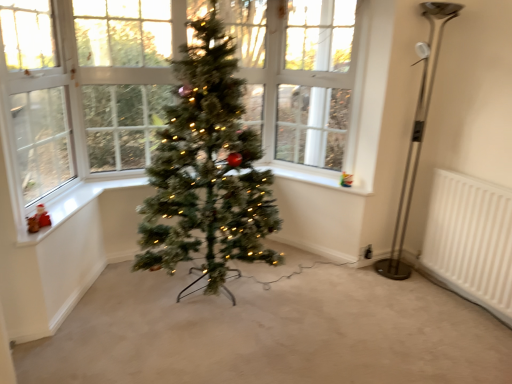
What do you see at coordinates (207, 169) in the screenshot? I see `green artificial christmas tree at center` at bounding box center [207, 169].

Describe the element at coordinates (417, 133) in the screenshot. I see `polished metal floor lamp at right` at that location.

Locate an element on the screen. This screenshot has height=384, width=512. clear glass window at left, which is the second window screen from right to left is located at coordinates [36, 98].

Where is `green artificial christmas tree at center`? The height and width of the screenshot is (384, 512). green artificial christmas tree at center is located at coordinates [x=207, y=169].

Consider the image. Which is more to the left, clear glass window at upper center, which appears as the first window screen when viewed from the back, or white painted wood at lower left, which appears as the first window sill when viewed from the front?

white painted wood at lower left, which appears as the first window sill when viewed from the front.

Looking at this image, who is taller, clear glass window at upper center, which appears as the first window screen when viewed from the back, or white painted wood at lower left, which is the 1th window sill from left to right?

Standing taller between the two is clear glass window at upper center, which appears as the first window screen when viewed from the back.

Between clear glass window at upper center, which appears as the first window screen when viewed from the back, and white painted wood at lower left, which ranks as the 2th window sill in right-to-left order, which one has larger width?

white painted wood at lower left, which ranks as the 2th window sill in right-to-left order.

In the scene shown: Can we say green artificial christmas tree at center lies outside clear glass window at left, the 1th window screen positioned from the front?

green artificial christmas tree at center is positioned outside clear glass window at left, the 1th window screen positioned from the front.

The width and height of the screenshot is (512, 384). I want to click on window screen that appears on the left of green artificial christmas tree at center, so click(36, 98).

Which of these two, green artificial christmas tree at center or clear glass window at left, which ranks as the first window screen in left-to-right order, is smaller?

Smaller between the two is clear glass window at left, which ranks as the first window screen in left-to-right order.

Is point (257, 249) closer or farther from the camera than point (29, 22)?

Point (257, 249) is farther from the camera than point (29, 22).

Does green artificial christmas tree at center have a greater height compared to white plastic at upper center, which is counted as the first window sill, starting from the right?

Yes, green artificial christmas tree at center is taller than white plastic at upper center, which is counted as the first window sill, starting from the right.

Between green artificial christmas tree at center and white plastic at upper center, which is counted as the first window sill, starting from the right, which one appears on the right side from the viewer's perspective?

Positioned to the right is white plastic at upper center, which is counted as the first window sill, starting from the right.

Is point (208, 135) less distant than point (331, 175)?

Yes, point (208, 135) is in front of point (331, 175).

How different are the orientations of green artificial christmas tree at center and white plastic at upper center, which is counted as the first window sill, starting from the right, in degrees?

The facing directions of green artificial christmas tree at center and white plastic at upper center, which is counted as the first window sill, starting from the right, are 59.7 degrees apart.

Which object is positioned more to the left, clear glass window at left, which ranks as the first window screen in left-to-right order, or polished metal floor lamp at right?

From the viewer's perspective, clear glass window at left, which ranks as the first window screen in left-to-right order, appears more on the left side.

From a real-world perspective, which is physically below, clear glass window at left, which is the second window screen from right to left, or polished metal floor lamp at right?

polished metal floor lamp at right, from a real-world perspective.

Can you confirm if clear glass window at left, which ranks as the first window screen in left-to-right order, is thinner than polished metal floor lamp at right?

Yes, clear glass window at left, which ranks as the first window screen in left-to-right order, is thinner than polished metal floor lamp at right.

Considering the sizes of clear glass window at left, which ranks as the first window screen in left-to-right order, and polished metal floor lamp at right in the image, is clear glass window at left, which ranks as the first window screen in left-to-right order, taller or shorter than polished metal floor lamp at right?

Considering their sizes, clear glass window at left, which ranks as the first window screen in left-to-right order, has less height than polished metal floor lamp at right.

From a real-world perspective, is clear glass window at left, the 1th window screen positioned from the front, positioned over green artificial christmas tree at center based on gravity?

Indeed, from a real-world perspective, clear glass window at left, the 1th window screen positioned from the front, stands above green artificial christmas tree at center.

Considering the sizes of objects clear glass window at left, which is the second window screen in back-to-front order, and green artificial christmas tree at center in the image provided, who is smaller, clear glass window at left, which is the second window screen in back-to-front order, or green artificial christmas tree at center?

With smaller size is clear glass window at left, which is the second window screen in back-to-front order.

Which of these two, clear glass window at left, which ranks as the first window screen in left-to-right order, or green artificial christmas tree at center, stands shorter?

Standing shorter between the two is clear glass window at left, which ranks as the first window screen in left-to-right order.

Can you see white plastic at upper center, the second window sill when ordered from front to back, touching white painted wood at lower left, the second window sill from the back?

No.

From the image's perspective, which one is positioned lower, white plastic at upper center, acting as the second window sill starting from the left, or white painted wood at lower left, which ranks as the 2th window sill in right-to-left order?

white painted wood at lower left, which ranks as the 2th window sill in right-to-left order, from the image's perspective.

Is white plastic at upper center, the second window sill when ordered from front to back, looking in the opposite direction of white painted wood at lower left, the second window sill from the back?

white plastic at upper center, the second window sill when ordered from front to back, is not turned away from white painted wood at lower left, the second window sill from the back.

Is white plastic at upper center, the second window sill when ordered from front to back, completely or partially outside of white painted wood at lower left, the second window sill from the back?

Absolutely, white plastic at upper center, the second window sill when ordered from front to back, is external to white painted wood at lower left, the second window sill from the back.

Is white painted wood at lower left, which ranks as the 2th window sill in right-to-left order, inside or outside of white plastic at upper center, acting as the second window sill starting from the left?

white painted wood at lower left, which ranks as the 2th window sill in right-to-left order, lies outside white plastic at upper center, acting as the second window sill starting from the left.

Looking at the image, does white painted wood at lower left, the second window sill from the back, seem bigger or smaller compared to white plastic at upper center, the second window sill when ordered from front to back?

Considering their sizes, white painted wood at lower left, the second window sill from the back, takes up less space than white plastic at upper center, the second window sill when ordered from front to back.

Looking at this image, is white painted wood at lower left, which is the 1th window sill from left to right, turned away from white plastic at upper center, the second window sill when ordered from front to back?

No.

This screenshot has height=384, width=512. Identify the location of window sill in front of the white plastic at upper center, which is counted as the 1th window sill, starting from the back. (65, 209).

Find the location of a particular element. window screen behind the white painted wood at lower left, which appears as the first window sill when viewed from the front is located at coordinates (315, 83).

At what (x,y) coordinates should I click in order to perform the action: click on christmas tree beneath the clear glass window at left, the 1th window screen positioned from the front (from a real-world perspective). Please return your answer as a coordinate pair (x, y). The width and height of the screenshot is (512, 384). Looking at the image, I should click on (207, 169).

From the image, which object appears to be farther from white plastic at upper center, the second window sill when ordered from front to back, white painted wood at lower left, which ranks as the 2th window sill in right-to-left order, or polished metal floor lamp at right?

white painted wood at lower left, which ranks as the 2th window sill in right-to-left order, is further to white plastic at upper center, the second window sill when ordered from front to back.

Consider the image. Estimate the real-world distances between objects in this image. Which object is further from polished metal floor lamp at right, clear glass window at left, the 1th window screen positioned from the front, or clear glass window at upper center, which appears as the first window screen when viewed from the back?

Based on the image, clear glass window at left, the 1th window screen positioned from the front, appears to be further to polished metal floor lamp at right.

Which object lies further to the anchor point clear glass window at upper center, the second window screen positioned from the left, white painted wood at lower left, the second window sill from the back, or green artificial christmas tree at center?

white painted wood at lower left, the second window sill from the back.

From the image, which object appears to be nearer to white plastic at upper center, which is counted as the 1th window sill, starting from the back, green artificial christmas tree at center or clear glass window at left, which is the second window screen from right to left?

green artificial christmas tree at center is closer to white plastic at upper center, which is counted as the 1th window sill, starting from the back.

Based on their spatial positions, is polished metal floor lamp at right or green artificial christmas tree at center closer to clear glass window at upper center, the second window screen viewed from the front?

polished metal floor lamp at right is positioned closer to the anchor clear glass window at upper center, the second window screen viewed from the front.

Looking at the image, which one is located closer to polished metal floor lamp at right, white plastic at upper center, which is counted as the 1th window sill, starting from the back, or white painted wood at lower left, which ranks as the 2th window sill in right-to-left order?

The object closer to polished metal floor lamp at right is white plastic at upper center, which is counted as the 1th window sill, starting from the back.

Which object lies nearer to the anchor point white painted wood at lower left, which is the 1th window sill from left to right, clear glass window at upper center, the second window screen viewed from the front, or green artificial christmas tree at center?

Based on the image, green artificial christmas tree at center appears to be nearer to white painted wood at lower left, which is the 1th window sill from left to right.

Based on their spatial positions, is clear glass window at upper center, which appears as the first window screen when viewed from the back, or polished metal floor lamp at right further from white plastic at upper center, acting as the second window sill starting from the left?

polished metal floor lamp at right lies further to white plastic at upper center, acting as the second window sill starting from the left, than the other object.

This screenshot has height=384, width=512. In order to click on window sill situated between white painted wood at lower left, which is the 1th window sill from left to right, and polished metal floor lamp at right from left to right in this screenshot , I will do `click(310, 176)`.

Find the location of `window screen between white painted wood at lower left, which appears as the first window sill when viewed from the front, and white plastic at upper center, which is counted as the first window sill, starting from the right, in the horizontal direction`. window screen between white painted wood at lower left, which appears as the first window sill when viewed from the front, and white plastic at upper center, which is counted as the first window sill, starting from the right, in the horizontal direction is located at coordinates pyautogui.click(x=315, y=83).

This screenshot has width=512, height=384. Find the location of `christmas tree between white painted wood at lower left, the second window sill from the back, and white plastic at upper center, the second window sill when ordered from front to back, from left to right`. christmas tree between white painted wood at lower left, the second window sill from the back, and white plastic at upper center, the second window sill when ordered from front to back, from left to right is located at coordinates (207, 169).

Where is `window screen between clear glass window at left, the 1th window screen positioned from the front, and white plastic at upper center, which is counted as the 1th window sill, starting from the back`? The image size is (512, 384). window screen between clear glass window at left, the 1th window screen positioned from the front, and white plastic at upper center, which is counted as the 1th window sill, starting from the back is located at coordinates (315, 83).